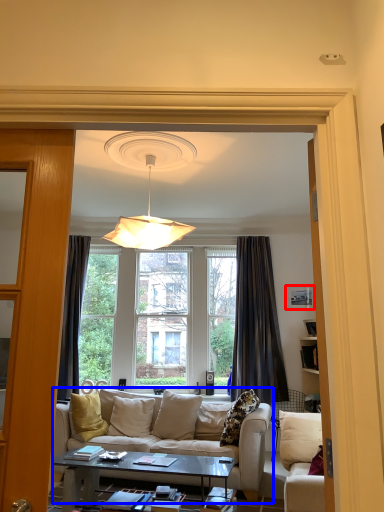
Question: Which point is closer to the camera, picture frame (highlighted by a red box) or studio couch (highlighted by a blue box)?

Choices:
 (A) picture frame
 (B) studio couch

Answer: (B)